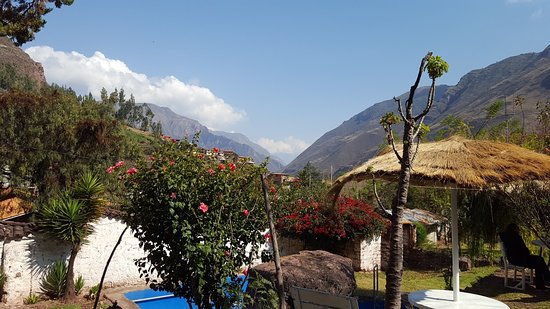
Identify the location of chair leg. The width and height of the screenshot is (550, 309). (505, 277), (522, 280), (515, 274), (531, 274).